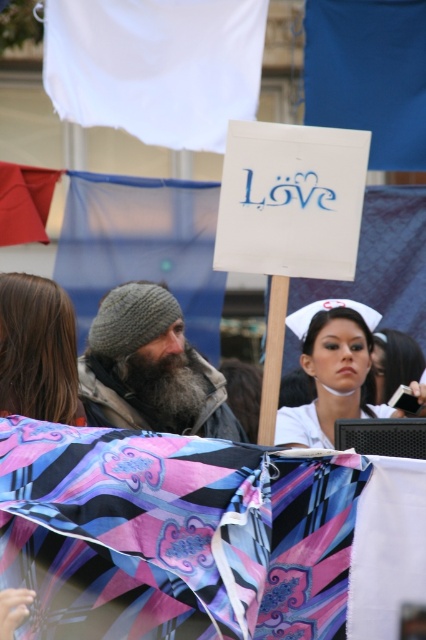
You are a photographer trying to capture the gray knitted beanie at center and the white matte nurse cap at center in the same frame. Which object is covering part of the other?

The gray knitted beanie at center is positioned over the white matte nurse cap at center, so it is covering part of it.

You are a photographer trying to capture the brown hair at left and the white matte nurse cap at center in a single shot. Based on their positions, which object should you focus on first to ensure both are in clear focus?

You should focus on the white matte nurse cap at center first because the brown hair at left is closer to the viewer, so adjusting focus from near to far will help both be in focus.